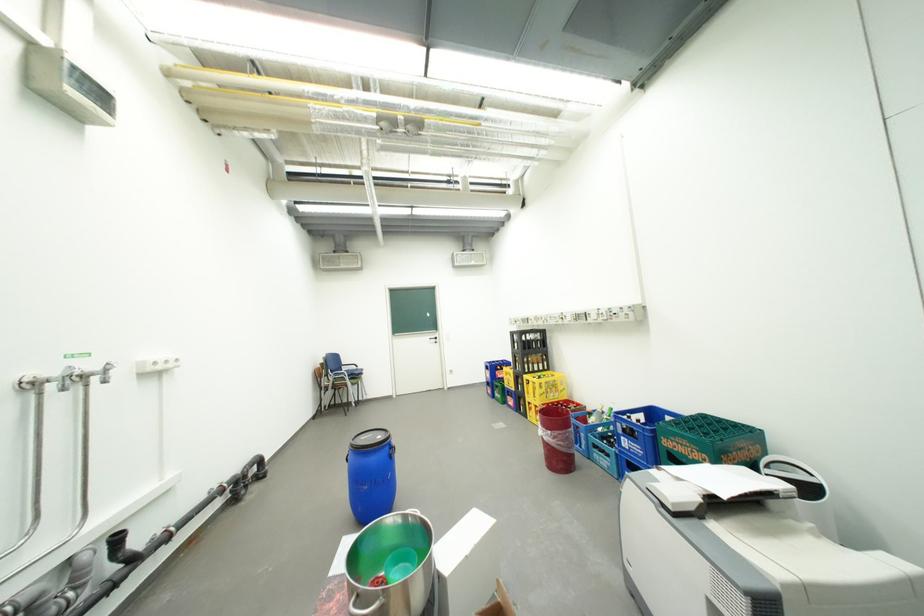
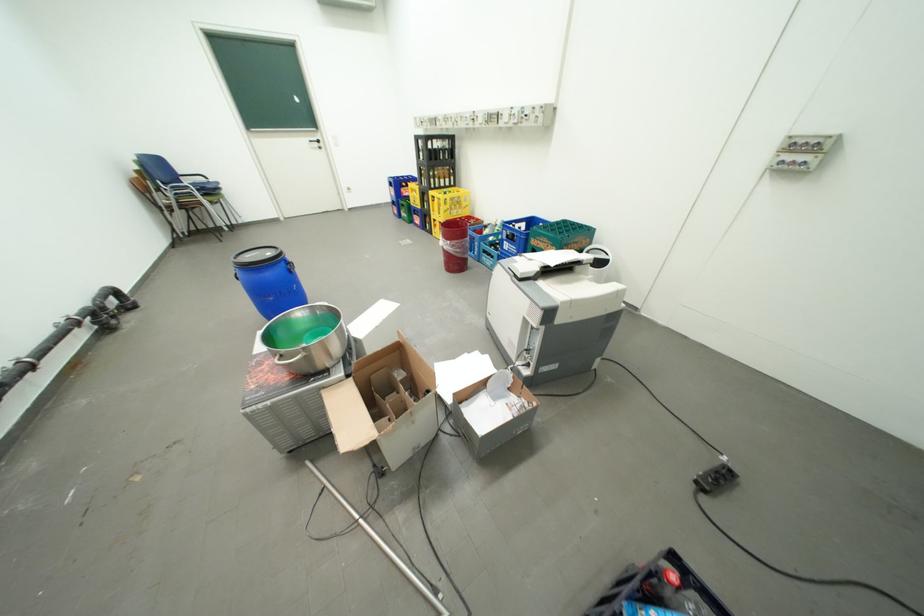
Locate, in the second image, the point that corresponds to point 555,395 in the first image.

(459, 212)